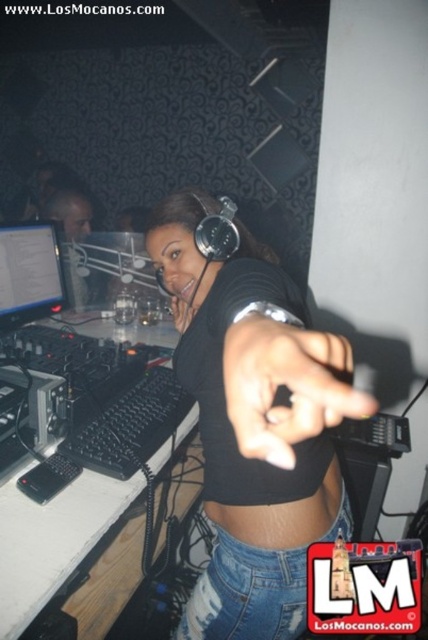
Question: Which point appears closest to the camera in this image?

Choices:
 (A) (240, 465)
 (B) (205, 509)

Answer: (A)

Question: Is black matte hand at center behind matte black monitor at left?

Choices:
 (A) no
 (B) yes

Answer: (A)

Question: Which of the following is the closest to the observer?

Choices:
 (A) (8, 276)
 (B) (315, 536)
 (C) (326, 420)
 (D) (207, 346)

Answer: (C)

Question: Which object is positioned closest to the black matte headphones at upper center?

Choices:
 (A) black matte skin at center
 (B) black matte hand at center
 (C) matte black monitor at left

Answer: (A)

Question: Can you confirm if matte black monitor at left is positioned to the left of black matte skin at center?

Choices:
 (A) yes
 (B) no

Answer: (A)

Question: Does black matte hand at center come behind matte black monitor at left?

Choices:
 (A) yes
 (B) no

Answer: (B)